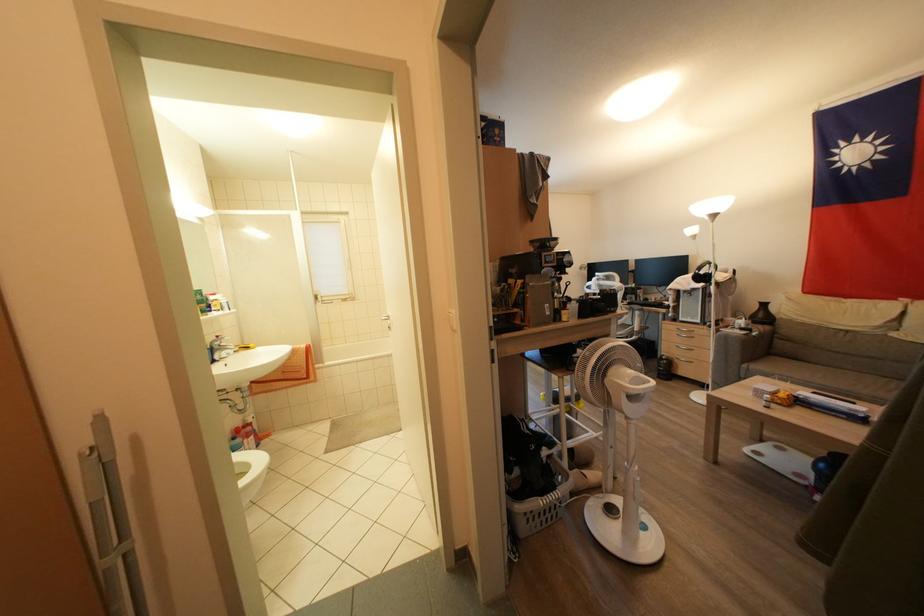
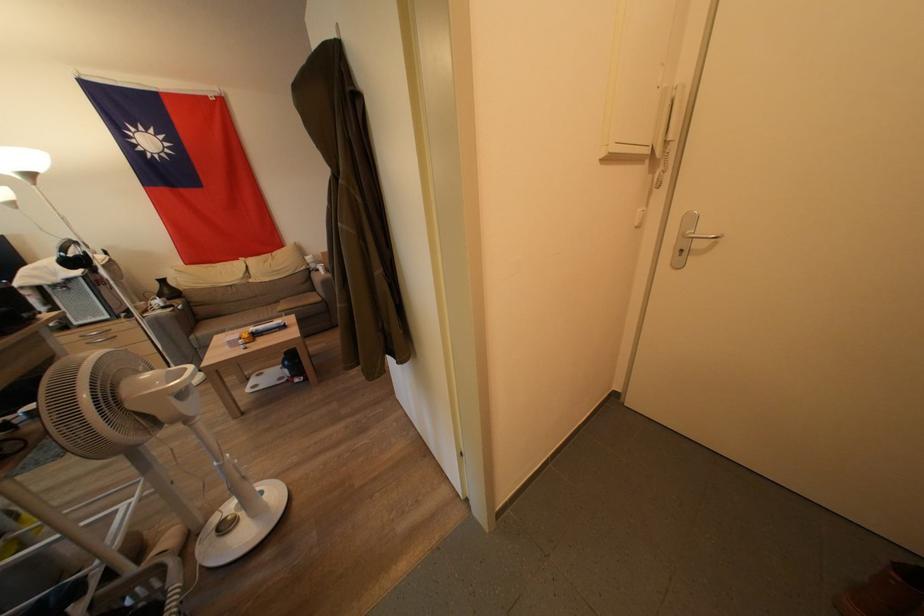
Find the pixel in the second image that matches the point at 792,342 in the first image.

(207, 309)